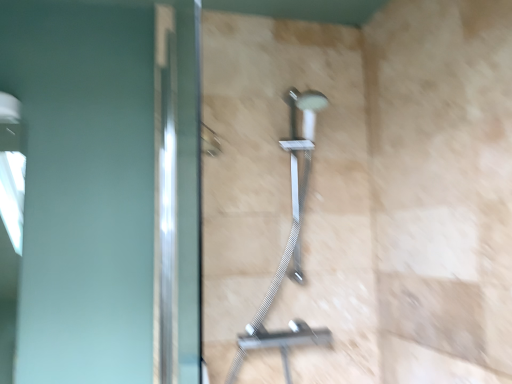
Question: Does satin nickel shower at center have a lesser height compared to polished silver screen door at left?

Choices:
 (A) yes
 (B) no

Answer: (A)

Question: Could you tell me if satin nickel shower at center is facing polished silver screen door at left?

Choices:
 (A) no
 (B) yes

Answer: (A)

Question: Does satin nickel shower at center come behind polished silver screen door at left?

Choices:
 (A) no
 (B) yes

Answer: (B)

Question: Is satin nickel shower at center outside polished silver screen door at left?

Choices:
 (A) yes
 (B) no

Answer: (A)

Question: Is satin nickel shower at center touching polished silver screen door at left?

Choices:
 (A) no
 (B) yes

Answer: (A)

Question: From a real-world perspective, is satin nickel shower at center on top of polished silver screen door at left?

Choices:
 (A) yes
 (B) no

Answer: (B)

Question: Does polished silver screen door at left have a greater width compared to satin nickel shower at center?

Choices:
 (A) yes
 (B) no

Answer: (B)

Question: Is polished silver screen door at left oriented away from satin nickel shower at center?

Choices:
 (A) no
 (B) yes

Answer: (B)

Question: From the image's perspective, is polished silver screen door at left above satin nickel shower at center?

Choices:
 (A) yes
 (B) no

Answer: (A)

Question: Can you confirm if polished silver screen door at left is shorter than satin nickel shower at center?

Choices:
 (A) yes
 (B) no

Answer: (B)

Question: Could you tell me if polished silver screen door at left is facing satin nickel shower at center?

Choices:
 (A) no
 (B) yes

Answer: (B)

Question: Is polished silver screen door at left surrounding satin nickel shower at center?

Choices:
 (A) no
 (B) yes

Answer: (A)

Question: Looking at their shapes, would you say satin nickel shower at center is wider or thinner than polished silver screen door at left?

Choices:
 (A) wide
 (B) thin

Answer: (A)